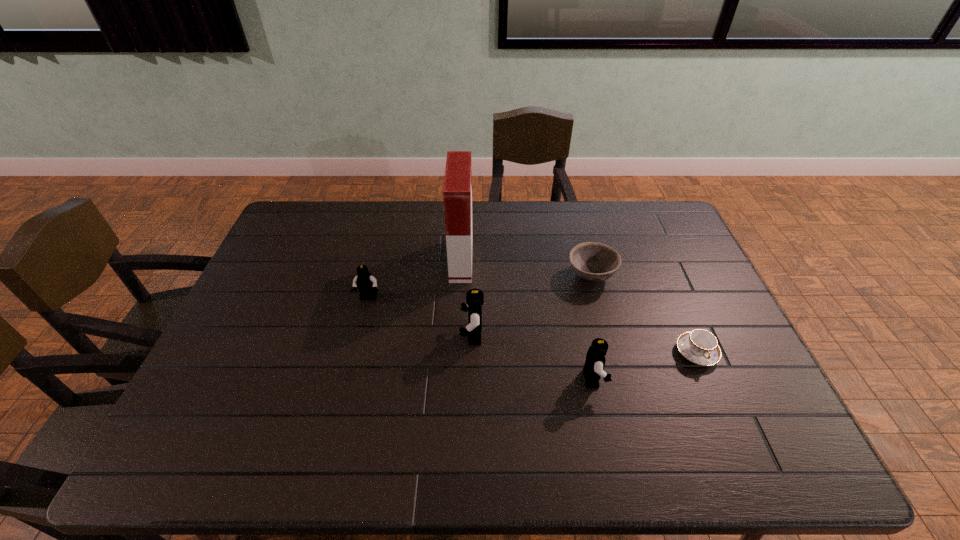
This screenshot has height=540, width=960. I want to click on free spot between the second farthest Lego and the shortest object, so click(584, 344).

I want to click on free space between the cigarette_case and the bowl, so click(x=526, y=268).

The width and height of the screenshot is (960, 540). What are the coordinates of `unoccupied position between the rightmost object and the second shortest object` in the screenshot? It's located at (644, 314).

Where is `free space between the tallest object and the second shortest object`? The width and height of the screenshot is (960, 540). free space between the tallest object and the second shortest object is located at coordinates (526, 268).

Where is `the fifth closest object relative to the tallest object`? The height and width of the screenshot is (540, 960). the fifth closest object relative to the tallest object is located at coordinates (701, 347).

Select which object appears as the fourth closest to the fifth tallest object. Please provide its 2D coordinates. Your answer should be formatted as a tuple, i.e. [(x, y)], where the tuple contains the x and y coordinates of a point satisfying the conditions above.

[(457, 191)]

Locate which Lego is the closest to the second shortest object. Please provide its 2D coordinates. Your answer should be formatted as a tuple, i.e. [(x, y)], where the tuple contains the x and y coordinates of a point satisfying the conditions above.

[(593, 368)]

What are the coordinates of `Lego identified as the second closest to the third tallest object` in the screenshot? It's located at click(x=365, y=282).

At what (x,y) coordinates should I click in order to perform the action: click on vacant space that satisfies the following two spatial constraints: 1. on the front-facing side of the tallest object; 2. on the left side of the bowl. Please return your answer as a coordinate pair (x, y). Image resolution: width=960 pixels, height=540 pixels. Looking at the image, I should click on (461, 275).

The image size is (960, 540). What are the coordinates of `vacant region that satisfies the following two spatial constraints: 1. on the front-facing side of the cigarette_case; 2. on the left side of the fifth tallest object` in the screenshot? It's located at (461, 275).